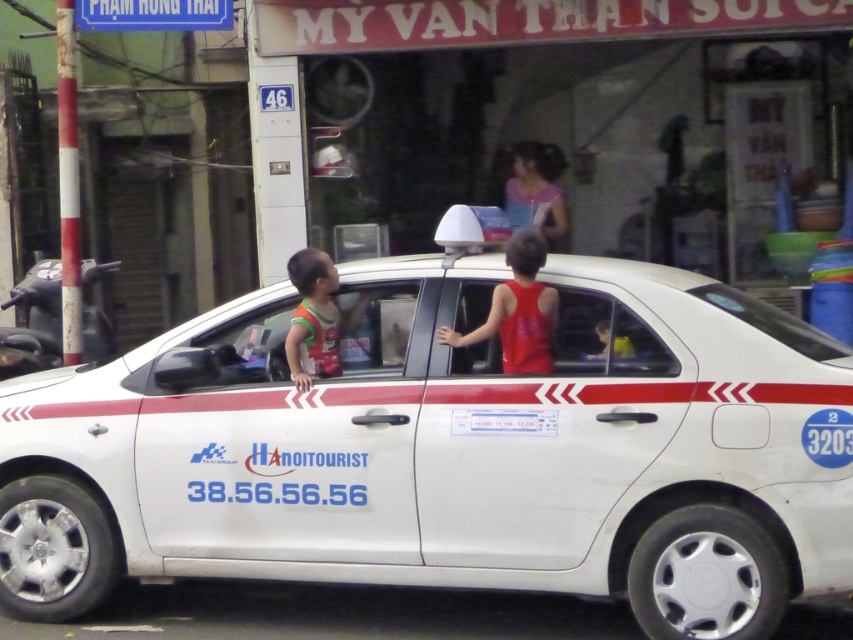
You are a delivery person who needs to place a small package on the orange fabric vest at center. Can you confirm the exact coordinates where you should place the package?

The orange fabric vest at center is located at coordinates point (316, 317), so you should place the package there.